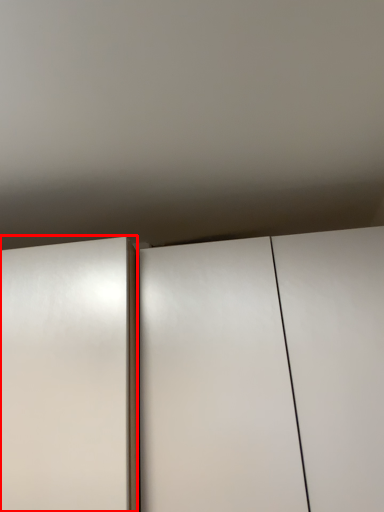
Question: From the image, what is the correct spatial relationship of door (annotated by the red box) in relation to cupboard?

Choices:
 (A) left
 (B) right

Answer: (A)